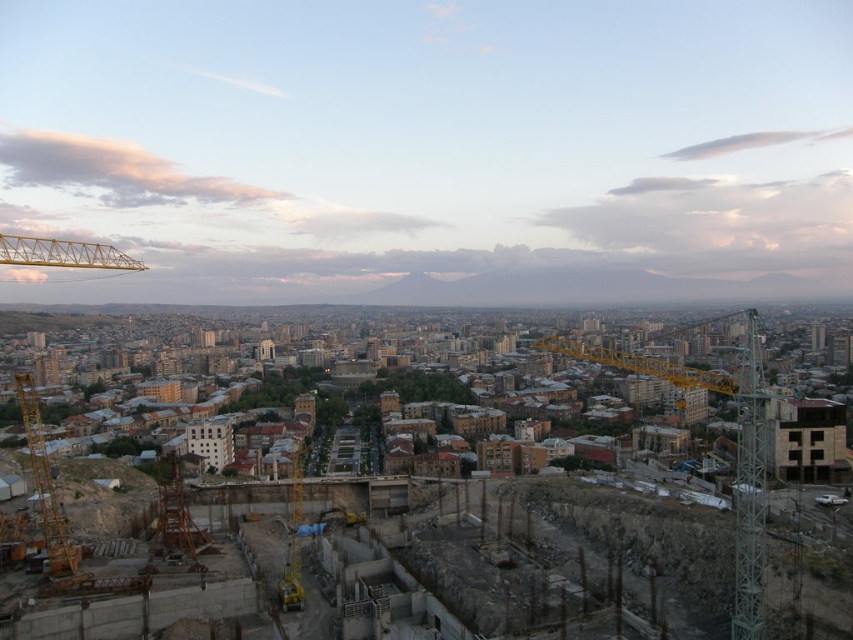
From the picture: You are a surveyor standing at the construction site in the cityscape image. You have two points marked on your map at coordinates point (57, 532) and point (109, 257). Which point is closer to you as you face the construction site?

Point (57, 532) is in front of point (109, 257), so it is closer to you as you face the construction site.

You are a city planner reviewing the construction site layout. The yellow metallic crane at lower left is crucial for lifting materials. Given its coordinates at point 0.762, 0.054, is it positioned closer to the edge of the construction site or near the center?

The yellow metallic crane at lower left is located at point (45, 486), which places it closer to the edge of the construction site rather than the center.